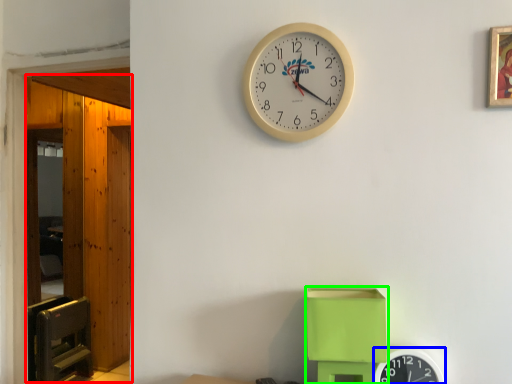
Question: Considering the real-world distances, which object is farthest from glass door (highlighted by a red box)? wall clock (highlighted by a blue box) or toy (highlighted by a green box)?

Choices:
 (A) wall clock
 (B) toy

Answer: (A)